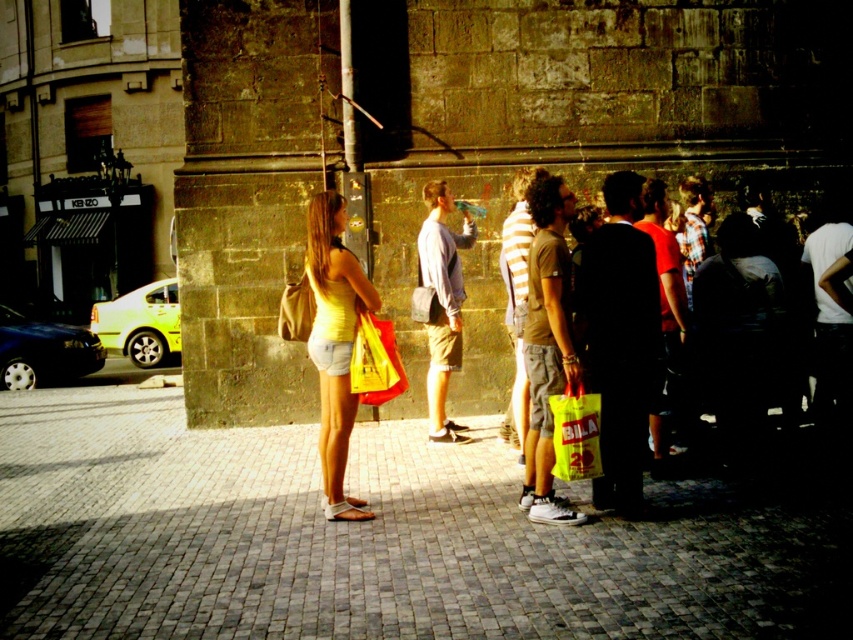
Which of these two, gray brick pavement at center or yellow plastic bag at center-right, stands shorter?

gray brick pavement at center

Who is positioned more to the left, gray brick pavement at center or yellow plastic bag at center-right?

Positioned to the left is gray brick pavement at center.

Is point (457, 476) more distant than point (543, 227)?

Yes, point (457, 476) is farther from viewer.

Find the location of a particular element. This screenshot has width=853, height=640. gray brick pavement at center is located at coordinates (369, 540).

Which of these two, gray brick pavement at center or light blue cotton shirt at center, stands taller?

Standing taller between the two is light blue cotton shirt at center.

Who is more forward, (627, 538) or (448, 440)?

Point (627, 538)

Where is `gray brick pavement at center`? gray brick pavement at center is located at coordinates (369, 540).

Can you confirm if gray brick pavement at center is positioned below yellow plastic bag at center?

Indeed, gray brick pavement at center is positioned under yellow plastic bag at center.

Does gray brick pavement at center have a lesser width compared to yellow plastic bag at center?

No.

Which is behind, point (347, 563) or point (589, 458)?

The point (589, 458) is more distant.

You are a GUI agent. You are given a task and a screenshot of the screen. Output one action in this format:
    pyautogui.click(x=<x>, y=<y>)
    Task: Click on the gray brick pavement at center
    
    Given the screenshot: What is the action you would take?
    pyautogui.click(x=369, y=540)